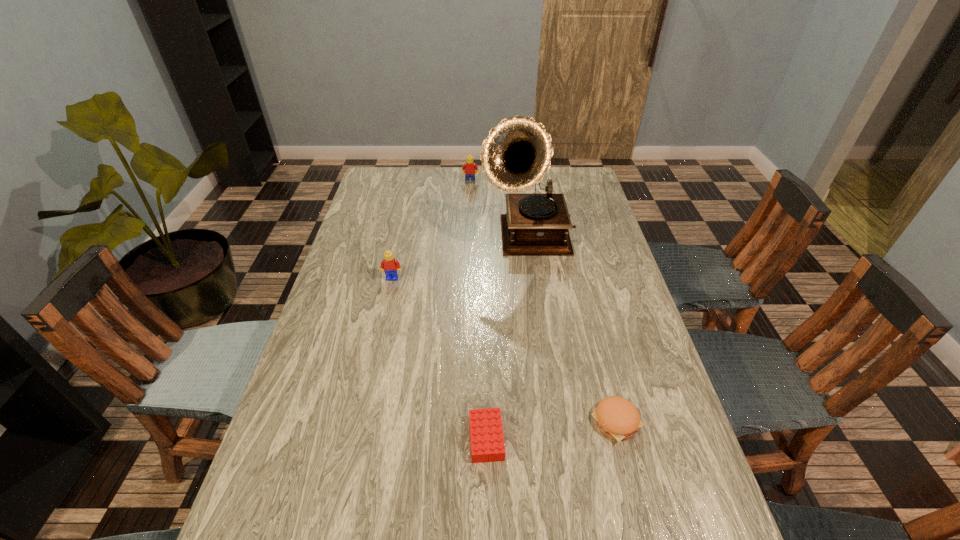
The height and width of the screenshot is (540, 960). In order to click on free space at the far right corner of the desktop in this screenshot , I will do `click(576, 182)`.

This screenshot has height=540, width=960. What are the coordinates of `vacant point located between the leftmost object and the farthest object` in the screenshot? It's located at (431, 230).

Locate an element on the screen. The image size is (960, 540). empty location between the leftmost object and the tallest object is located at coordinates [x=460, y=259].

Locate an element on the screen. The image size is (960, 540). empty space that is in between the shortest Lego and the patty is located at coordinates (551, 430).

Locate an element on the screen. Image resolution: width=960 pixels, height=540 pixels. free spot between the farthest Lego and the nearest Lego is located at coordinates (478, 310).

This screenshot has height=540, width=960. What are the coordinates of `vacant space that is in between the farthest Lego and the patty` in the screenshot? It's located at (543, 302).

Locate an element on the screen. free space that is in between the farthest object and the record player is located at coordinates (499, 211).

The width and height of the screenshot is (960, 540). Find the location of `free space between the tallest object and the patty`. free space between the tallest object and the patty is located at coordinates (572, 330).

Find the location of a particular element. Image resolution: width=960 pixels, height=540 pixels. free spot between the shortest Lego and the farthest Lego is located at coordinates (478, 310).

Where is `vacant space that's between the patty and the second farthest Lego`? The width and height of the screenshot is (960, 540). vacant space that's between the patty and the second farthest Lego is located at coordinates (504, 350).